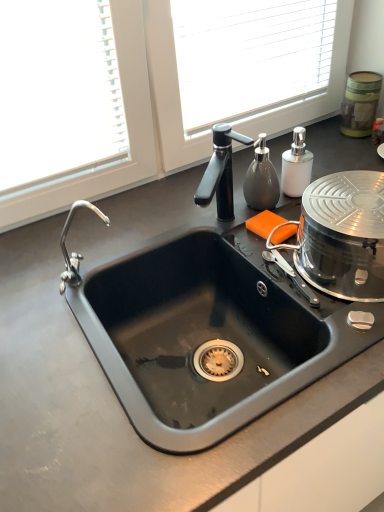
Where is `vacant area to the left of green textured canister at upper right, the second appliance positioned from the front`? vacant area to the left of green textured canister at upper right, the second appliance positioned from the front is located at coordinates (323, 144).